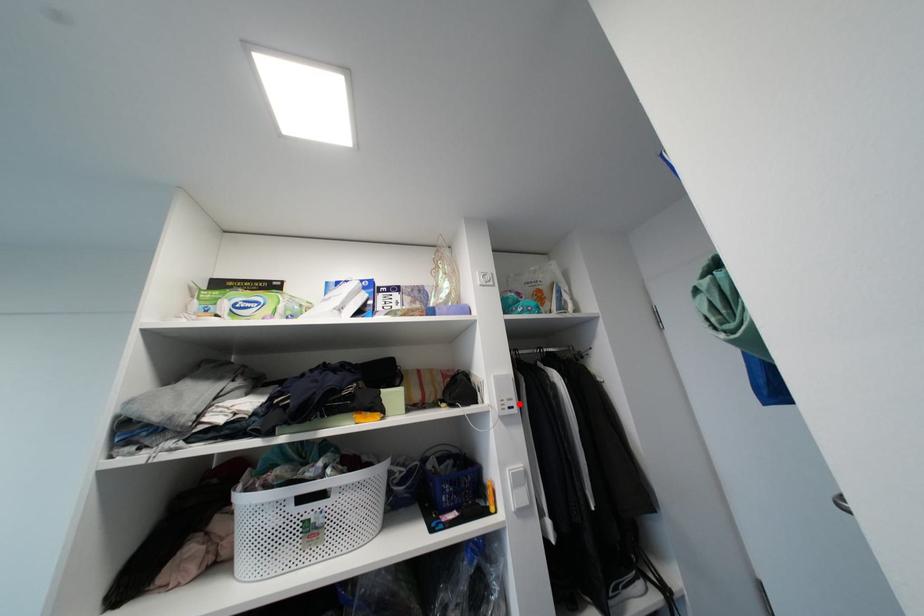
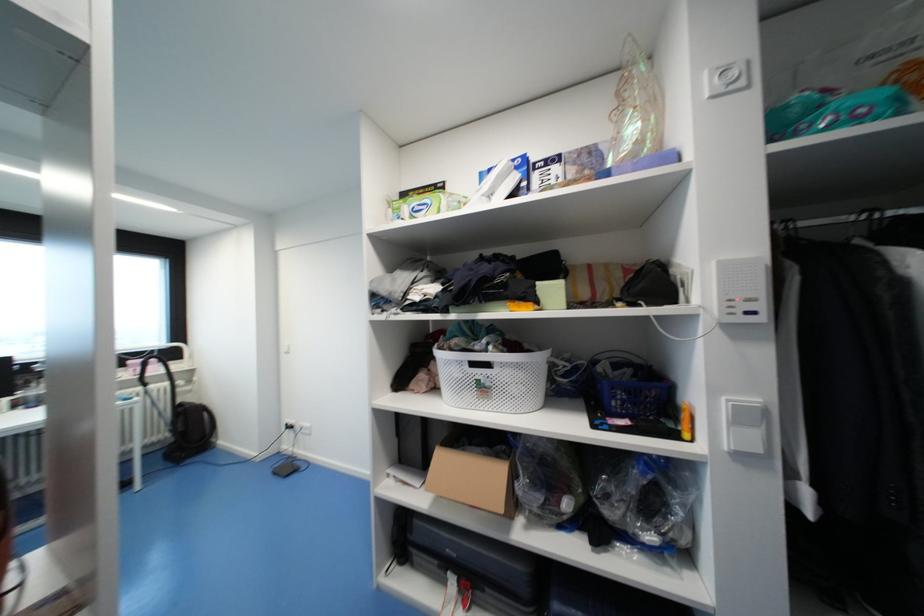
The point at the highlighted location is marked in the first image. Where is the corresponding point in the second image?

(767, 307)